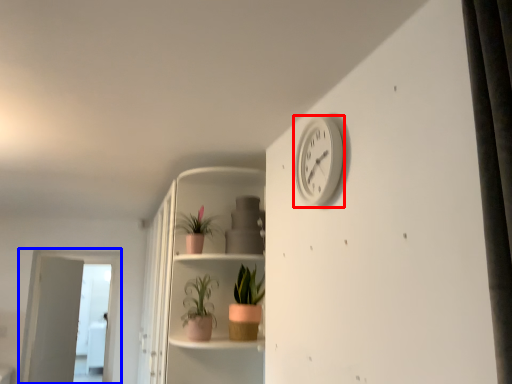
Question: Which object is closer to the camera taking this photo, clock (highlighted by a red box) or screen door (highlighted by a blue box)?

Choices:
 (A) clock
 (B) screen door

Answer: (A)